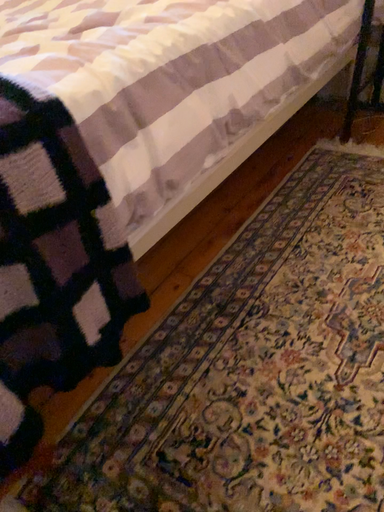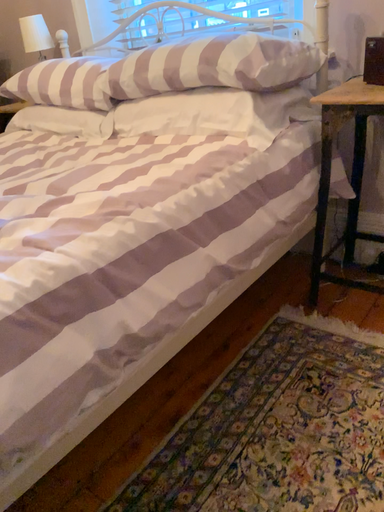
Question: How did the camera likely rotate when shooting the video?

Choices:
 (A) rotated upward
 (B) rotated downward

Answer: (A)